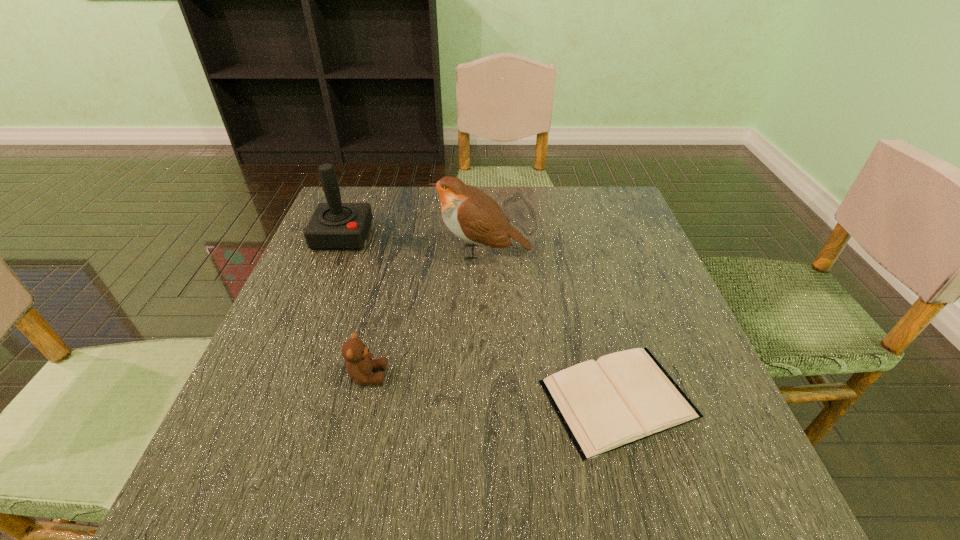
Where is `vacant area situated 0.160m on the left of the hardback book`? This screenshot has width=960, height=540. vacant area situated 0.160m on the left of the hardback book is located at coordinates (447, 399).

Where is `object present at the far edge`? This screenshot has width=960, height=540. object present at the far edge is located at coordinates (333, 225).

Locate an element on the screen. The image size is (960, 540). object that is at the near edge is located at coordinates (627, 396).

Identify the location of object that is at the left edge. (333, 225).

This screenshot has width=960, height=540. What are the coordinates of `object present at the right edge` in the screenshot? It's located at (627, 396).

Identify the location of object that is positioned at the far left corner. The height and width of the screenshot is (540, 960). (333, 225).

The width and height of the screenshot is (960, 540). Identify the location of object present at the near right corner. (627, 396).

What are the coordinates of `vacant space at the far edge` in the screenshot? It's located at (416, 197).

The image size is (960, 540). What are the coordinates of `free space at the near edge of the desktop` in the screenshot? It's located at (508, 458).

This screenshot has width=960, height=540. In the image, there is a desktop. In order to click on vacant space at the left edge in this screenshot , I will do `click(250, 371)`.